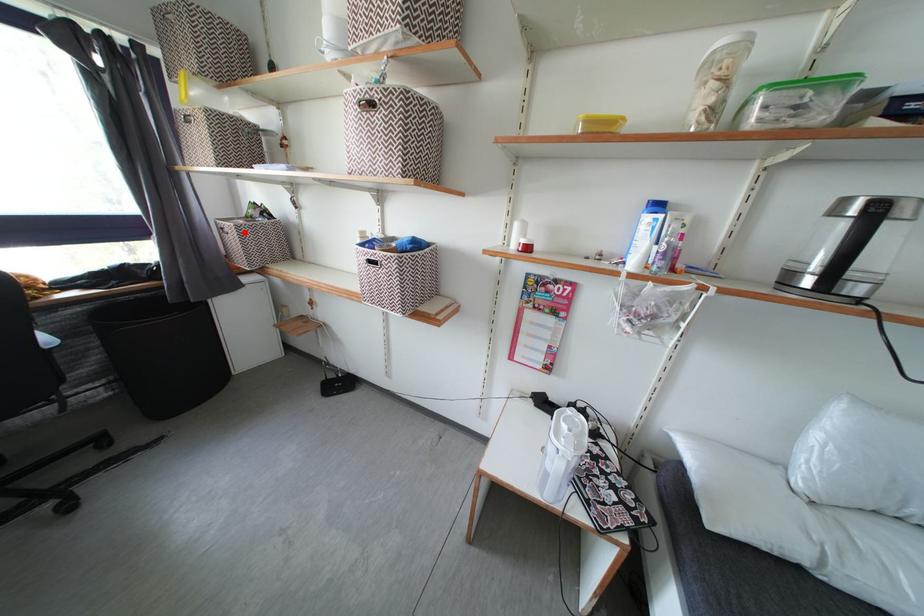
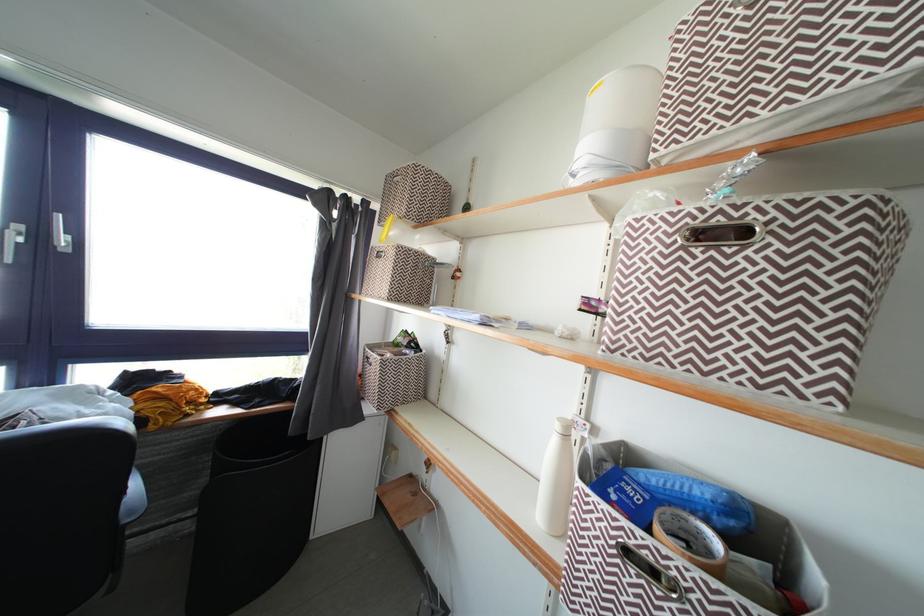
Question: I am providing you with two images of the same scene from different viewpoints. In image1, a red point is highlighted. Considering the same 3D point in image2, which of the following is correct?

Choices:
 (A) It is closer
 (B) It is farther

Answer: (B)